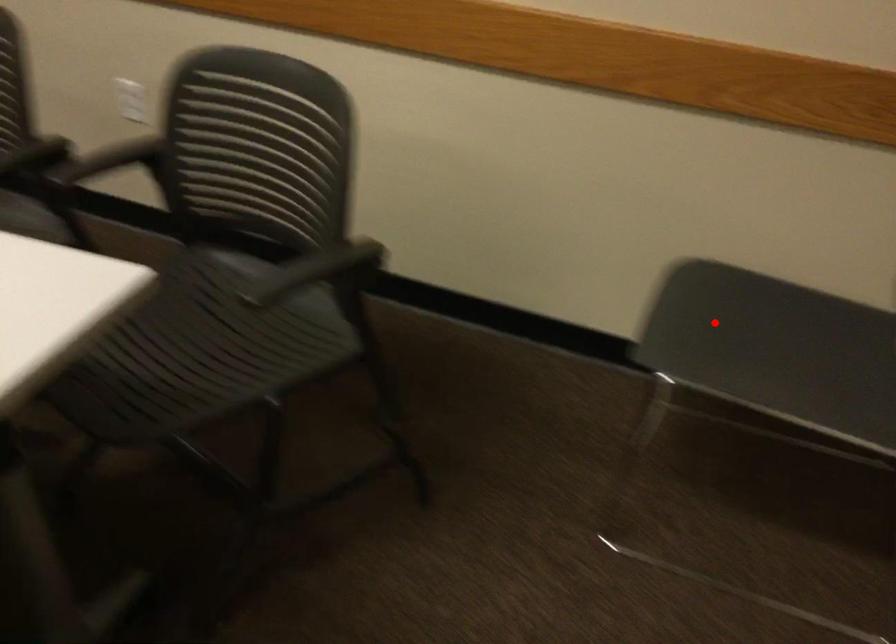
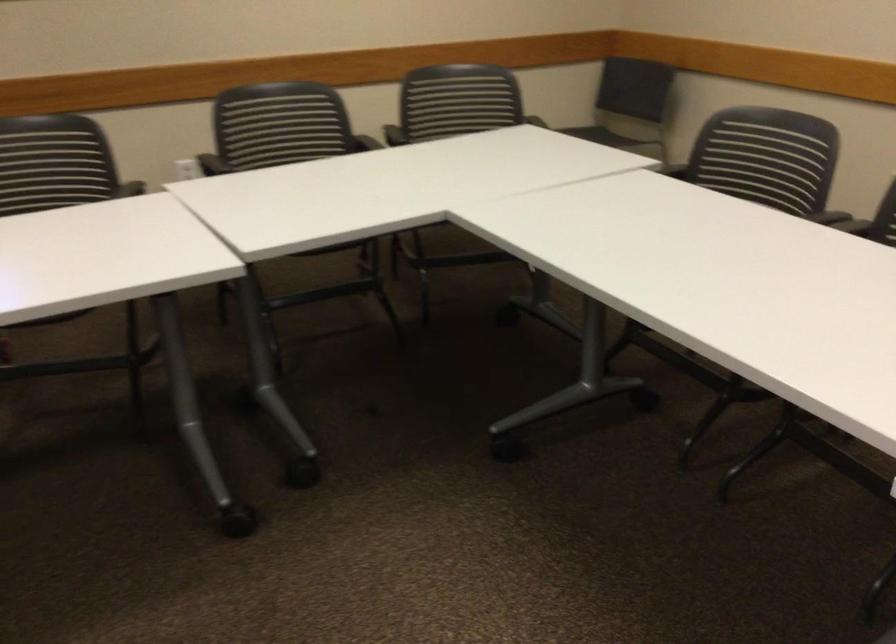
Question: I am providing you with two images of the same scene from different viewpoints. A red point is marked on the first image. Is the red point's position out of view in image 2?

Choices:
 (A) Yes
 (B) No

Answer: (A)